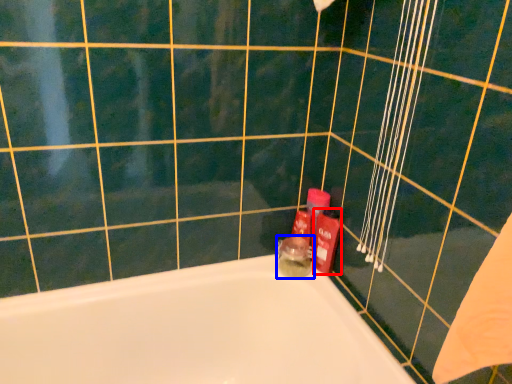
Question: Which object appears closest to the camera in this image, toiletry (highlighted by a red box) or toiletry (highlighted by a blue box)?

Choices:
 (A) toiletry
 (B) toiletry

Answer: (A)